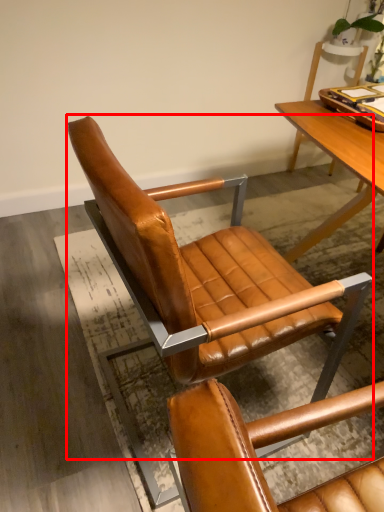
Question: Observing the image, what is the correct spatial positioning of chair (annotated by the red box) in reference to tray?

Choices:
 (A) right
 (B) left

Answer: (B)